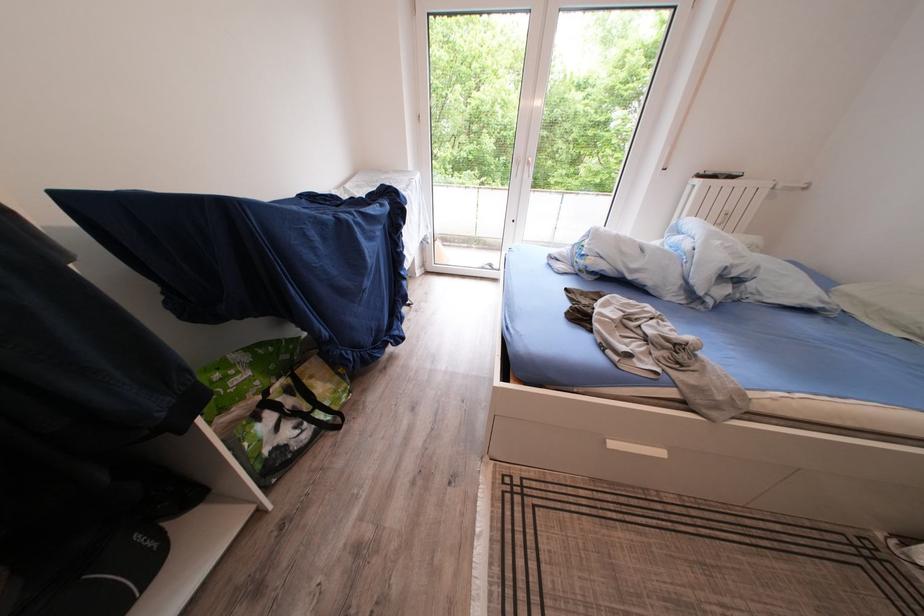
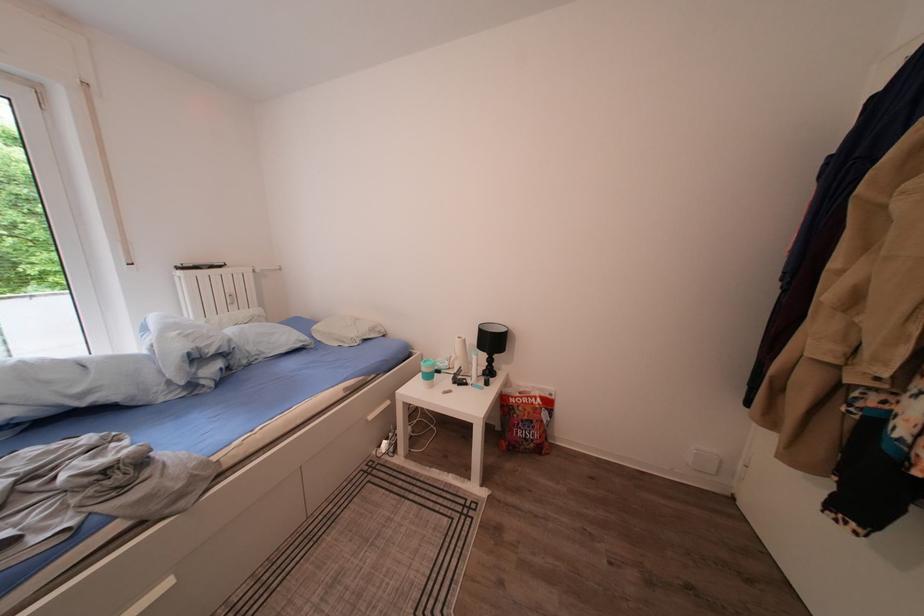
The point at (737, 213) is marked in the first image. Where is the corresponding point in the second image?

(238, 296)